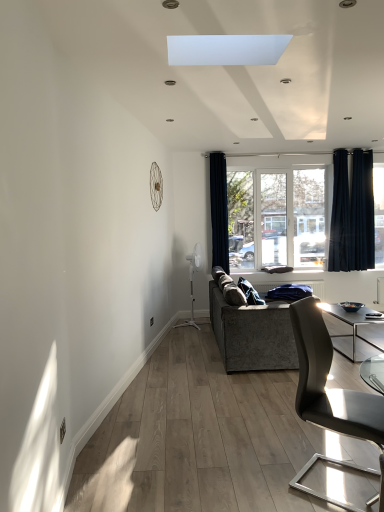
Find the location of a particular element. Image resolution: width=384 pixels, height=512 pixels. free area below matte black chair at lower right (from a real-world perspective) is located at coordinates [x=339, y=478].